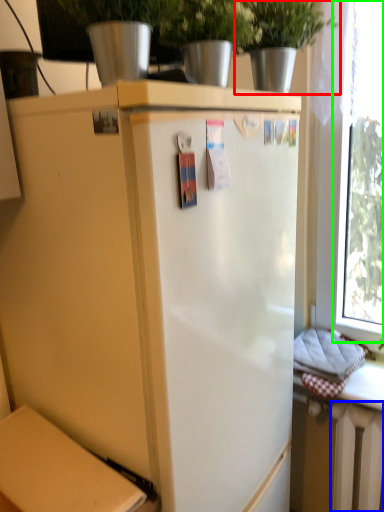
Question: Estimate the real-world distances between objects in this image. Which object is farther from houseplant (highlighted by a red box), radiator (highlighted by a blue box) or window (highlighted by a green box)?

Choices:
 (A) radiator
 (B) window

Answer: (A)